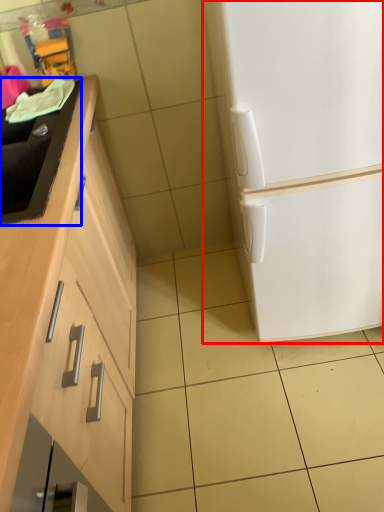
Question: Which of the following is the closest to the observer, refrigerator (highlighted by a red box) or sink (highlighted by a blue box)?

Choices:
 (A) refrigerator
 (B) sink

Answer: (A)